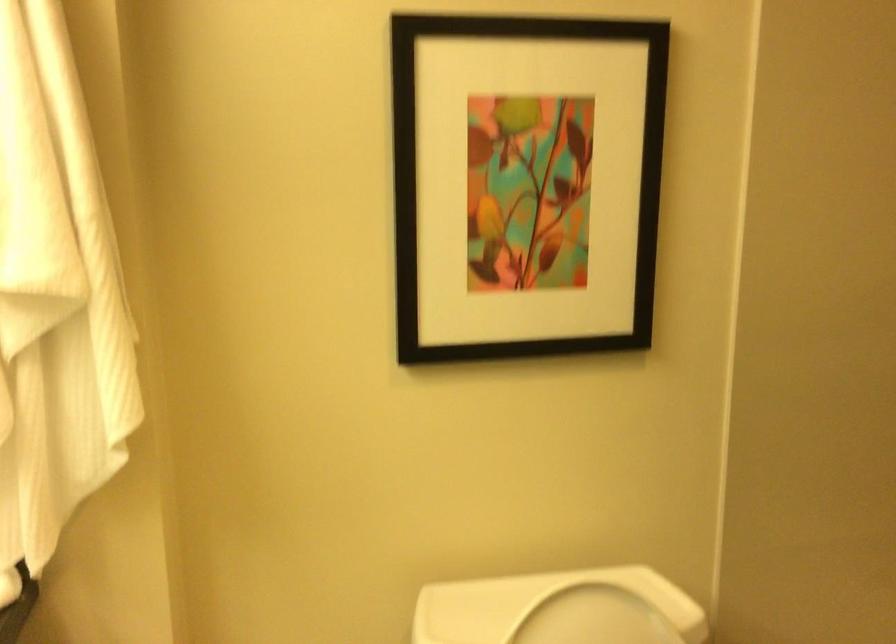
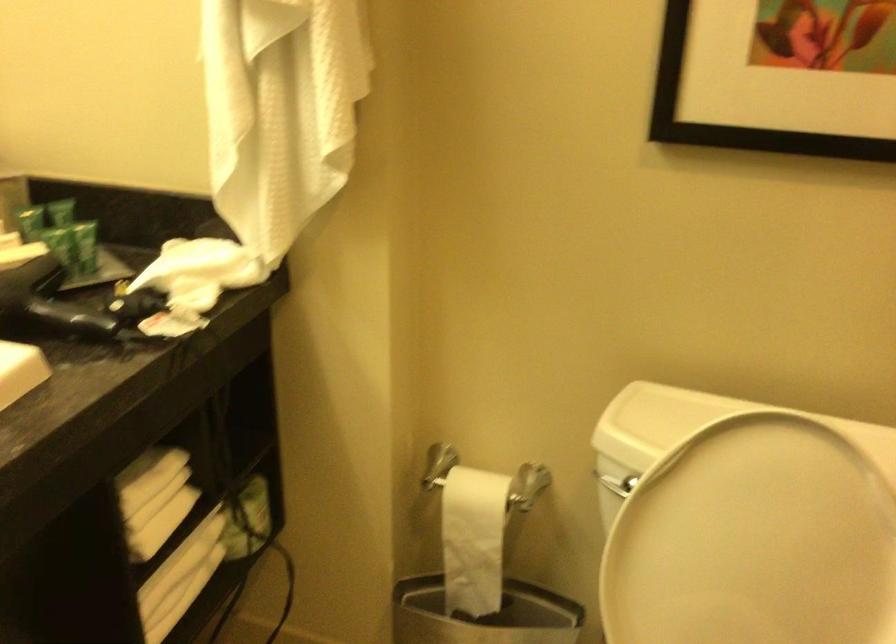
The first image is from the beginning of the video and the second image is from the end. How did the camera likely rotate when shooting the video?

The camera's rotation is toward left-down.